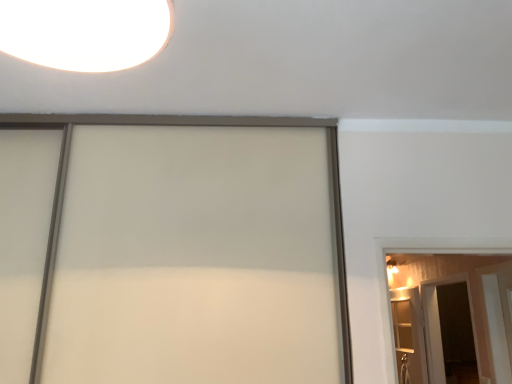
Describe the element at coordinates (408, 334) in the screenshot. I see `wooden elevator at right` at that location.

You are a GUI agent. You are given a task and a screenshot of the screen. Output one action in this format:
    pyautogui.click(x=<x>, y=<y>)
    Task: Click on the transparent glass screen door at lower right
    
    Given the screenshot: What is the action you would take?
    pyautogui.click(x=439, y=325)

This screenshot has height=384, width=512. What do you see at coordinates (451, 314) in the screenshot? I see `white glossy barn door at right` at bounding box center [451, 314].

The height and width of the screenshot is (384, 512). What are the coordinates of `wooden elevator at right` in the screenshot? It's located at (408, 334).

Can you confirm if wooden elevator at right is taller than white glossy barn door at right?

Yes.

From the image's perspective, which one is positioned lower, wooden elevator at right or white glossy barn door at right?

wooden elevator at right, from the image's perspective.

Is white glossy barn door at right completely or partially inside wooden elevator at right?

No, white glossy barn door at right is not inside wooden elevator at right.

Which is in front, point (399, 377) or point (479, 309)?

The point (479, 309) is in front.

Is white glossy barn door at right completely or partially inside transparent glass screen door at lower right?

No, white glossy barn door at right is not surrounded by transparent glass screen door at lower right.

From a real-world perspective, is transparent glass screen door at lower right below white glossy barn door at right?

Actually, transparent glass screen door at lower right is physically above white glossy barn door at right in the real world.

The height and width of the screenshot is (384, 512). I want to click on barn door above the transparent glass screen door at lower right (from the image's perspective), so click(x=451, y=314).

Which of these two, transparent glass screen door at lower right or white glossy barn door at right, stands taller?

transparent glass screen door at lower right.

Is white glossy barn door at right with wooden elevator at right?

No, white glossy barn door at right is not with wooden elevator at right.

Considering the relative sizes of white glossy barn door at right and wooden elevator at right in the image provided, is white glossy barn door at right wider than wooden elevator at right?

Indeed, white glossy barn door at right has a greater width compared to wooden elevator at right.

From a real-world perspective, which object stands above the other?

white glossy barn door at right.

Which of these two, transparent glass screen door at lower right or wooden elevator at right, is bigger?

With larger size is transparent glass screen door at lower right.

Is transparent glass screen door at lower right aimed at wooden elevator at right?

No, transparent glass screen door at lower right is not aimed at wooden elevator at right.

From the image's perspective, is transparent glass screen door at lower right located above wooden elevator at right?

Correct, transparent glass screen door at lower right appears higher than wooden elevator at right in the image.

Could wooden elevator at right be considered to be inside transparent glass screen door at lower right?

No, wooden elevator at right is not surrounded by transparent glass screen door at lower right.

Is wooden elevator at right oriented away from transparent glass screen door at lower right?

Yes, transparent glass screen door at lower right is at the back of wooden elevator at right.

Looking at this image, considering the relative sizes of wooden elevator at right and transparent glass screen door at lower right in the image provided, is wooden elevator at right taller than transparent glass screen door at lower right?

Incorrect, the height of wooden elevator at right is not larger of that of transparent glass screen door at lower right.

Can you tell me how much wooden elevator at right and transparent glass screen door at lower right differ in facing direction?

The angle between the facing direction of wooden elevator at right and the facing direction of transparent glass screen door at lower right is 76.7 degrees.

Considering the relative positions of wooden elevator at right and transparent glass screen door at lower right in the image provided, is wooden elevator at right to the right of transparent glass screen door at lower right from the viewer's perspective?

No.

Does white glossy barn door at right have a lesser width compared to transparent glass screen door at lower right?

In fact, white glossy barn door at right might be wider than transparent glass screen door at lower right.

Is white glossy barn door at right oriented towards transparent glass screen door at lower right?

No, white glossy barn door at right is not turned towards transparent glass screen door at lower right.

Relative to transparent glass screen door at lower right, is white glossy barn door at right in front or behind?

white glossy barn door at right is in front of transparent glass screen door at lower right.

From a real-world perspective, is white glossy barn door at right positioned under transparent glass screen door at lower right based on gravity?

Yes.

Find the location of a particular element. elevator behind the white glossy barn door at right is located at coordinates (408, 334).

Where is `screen door below the white glossy barn door at right (from the image's perspective)`? This screenshot has width=512, height=384. screen door below the white glossy barn door at right (from the image's perspective) is located at coordinates (439, 325).

Considering their positions, is wooden elevator at right positioned closer to white glossy barn door at right than transparent glass screen door at lower right?

transparent glass screen door at lower right is closer to white glossy barn door at right.

Which object lies nearer to the anchor point transparent glass screen door at lower right, wooden elevator at right or white glossy barn door at right?

white glossy barn door at right is closer to transparent glass screen door at lower right.

From the image, which object appears to be nearer to transparent glass screen door at lower right, white glossy barn door at right or wooden elevator at right?

white glossy barn door at right is closer to transparent glass screen door at lower right.

From the image, which object appears to be nearer to wooden elevator at right, white glossy barn door at right or transparent glass screen door at lower right?

Among the two, transparent glass screen door at lower right is located nearer to wooden elevator at right.

Looking at the image, which one is located further to wooden elevator at right, transparent glass screen door at lower right or white glossy barn door at right?

white glossy barn door at right is further to wooden elevator at right.

Which object lies further to the anchor point white glossy barn door at right, transparent glass screen door at lower right or wooden elevator at right?

wooden elevator at right is further to white glossy barn door at right.

Locate an element on the screen. This screenshot has width=512, height=384. elevator positioned between white glossy barn door at right and transparent glass screen door at lower right from near to far is located at coordinates (408, 334).